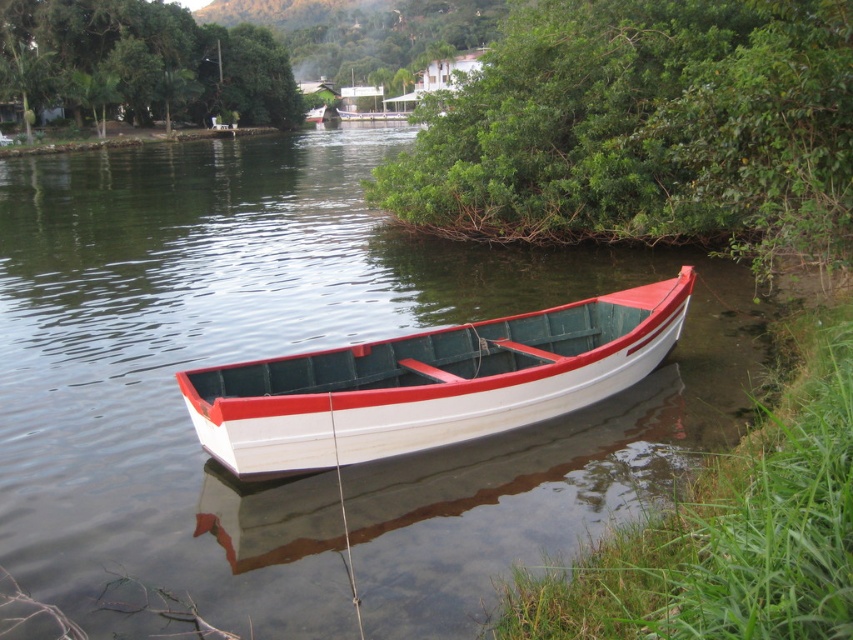
Does point (492, 160) come farther from viewer compared to point (491, 432)?

That is True.

From the picture: Does green leafy bush at upper right have a greater height compared to white matte boat at center?

Yes, green leafy bush at upper right is taller than white matte boat at center.

Which is behind, point (808, 221) or point (267, 396)?

The point (808, 221) is more distant.

This screenshot has width=853, height=640. I want to click on green leafy bush at upper right, so click(x=645, y=131).

Is point (529, 404) positioned before point (125, 6)?

Yes, it is in front of point (125, 6).

How much distance is there between white matte boat at center and green leafy tree at upper center?

white matte boat at center and green leafy tree at upper center are 102.50 meters apart from each other.

Image resolution: width=853 pixels, height=640 pixels. I want to click on white matte boat at center, so click(430, 384).

Can you confirm if green leafy bush at upper right is positioned above green leafy tree at upper center?

Actually, green leafy bush at upper right is below green leafy tree at upper center.

Consider the image. Who is higher up, green leafy bush at upper right or green leafy tree at upper center?

green leafy tree at upper center is higher up.

Measure the distance between green leafy bush at upper right and camera.

green leafy bush at upper right and camera are 9.63 meters apart from each other.

This screenshot has height=640, width=853. In order to click on green leafy bush at upper right in this screenshot , I will do `click(645, 131)`.